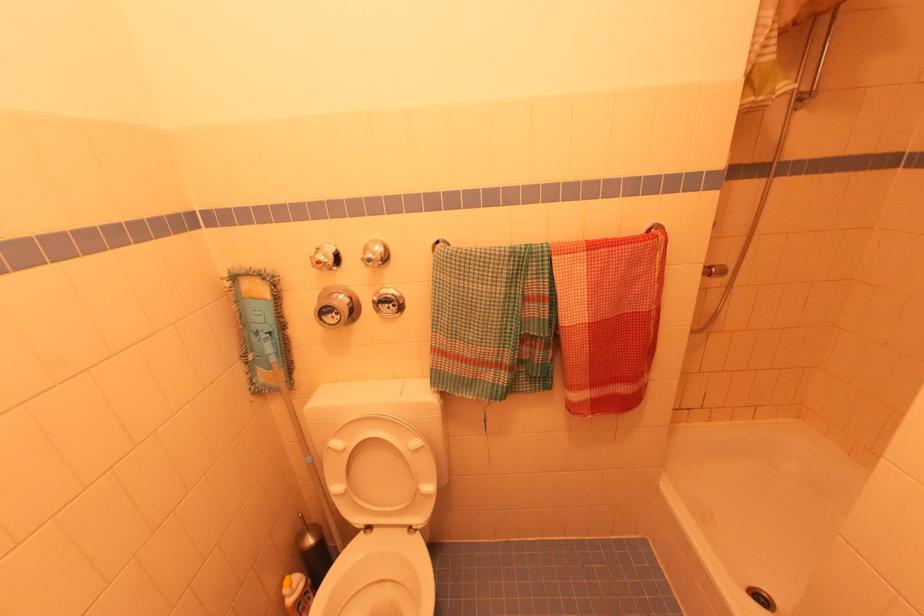
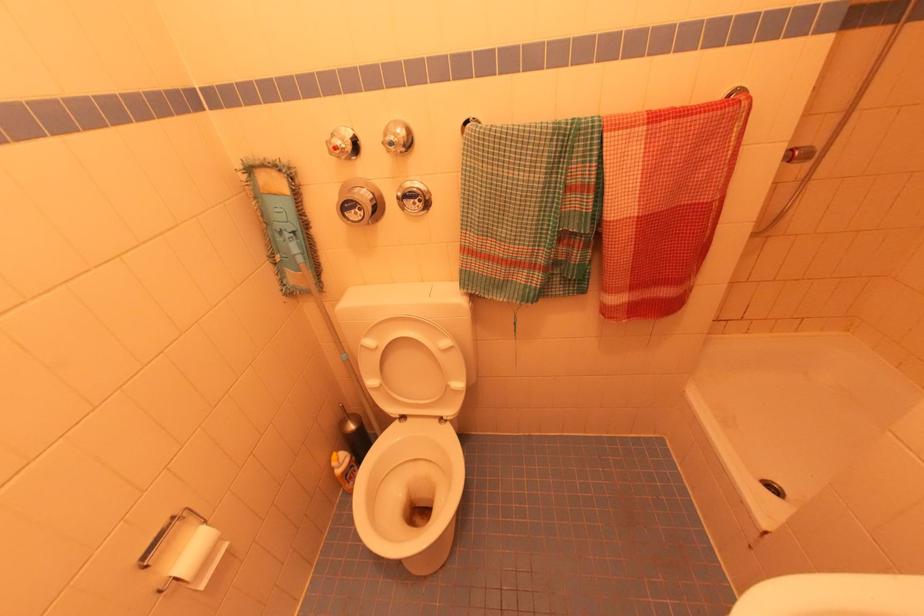
Based on the photo, what movement of the cameraman would produce the second image?

The cameraman walked toward left, forward.